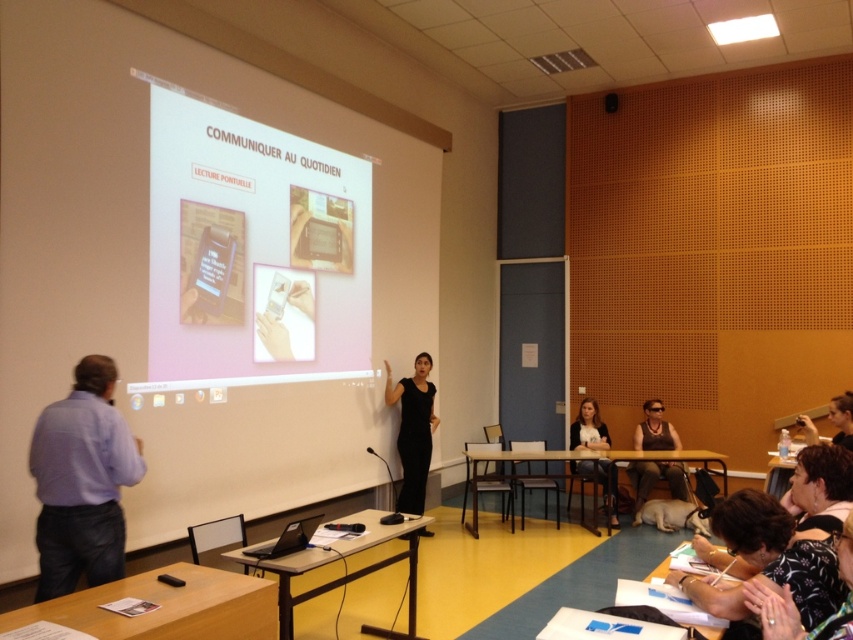
Is point (325, 324) closer to viewer compared to point (403, 401)?

That is True.

Looking at this image, measure the distance between white glossy projector screen at upper center and black matte dress at center.

white glossy projector screen at upper center and black matte dress at center are 4.29 feet apart.

Does point (300, 157) lie in front of point (430, 436)?

Yes, it is in front of point (430, 436).

Identify the location of white glossy projector screen at upper center. The image size is (853, 640). (251, 250).

Between floral-patterned blouse at lower right and black fabric shirt at center, which one has more height?

With more height is black fabric shirt at center.

Is point (787, 621) positioned after point (589, 429)?

No.

This screenshot has height=640, width=853. I want to click on floral-patterned blouse at lower right, so click(775, 611).

Find the location of a particular element. floral-patterned blouse at lower right is located at coordinates (775, 611).

Consider the image. Can you confirm if dark brown leather jacket at lower right is taller than matte black tank top at lower right?

Incorrect, dark brown leather jacket at lower right's height is not larger of matte black tank top at lower right's.

Does dark brown leather jacket at lower right lie in front of matte black tank top at lower right?

Yes, it is.

Which is behind, point (728, 612) or point (633, 484)?

The point (633, 484) is more distant.

Identify the location of dark brown leather jacket at lower right. (781, 552).